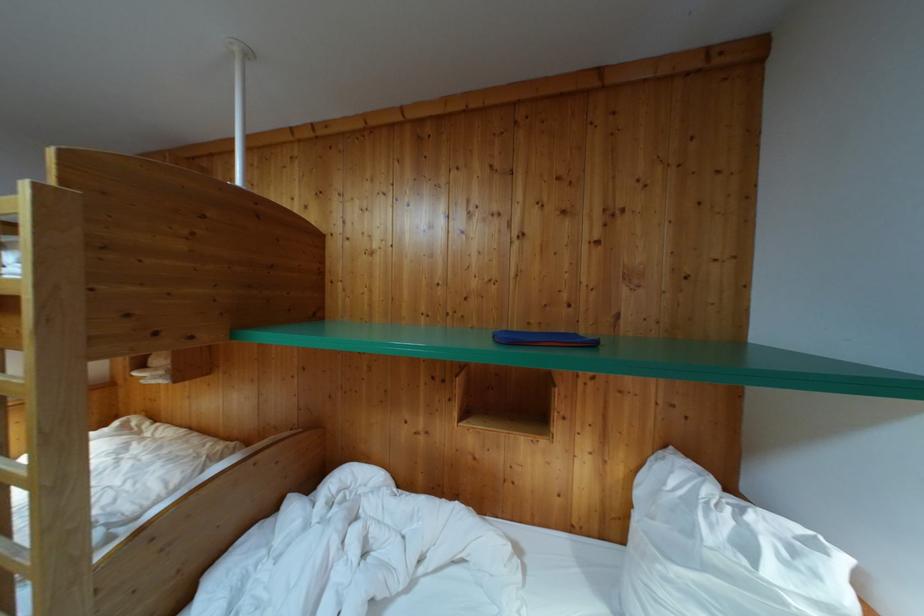
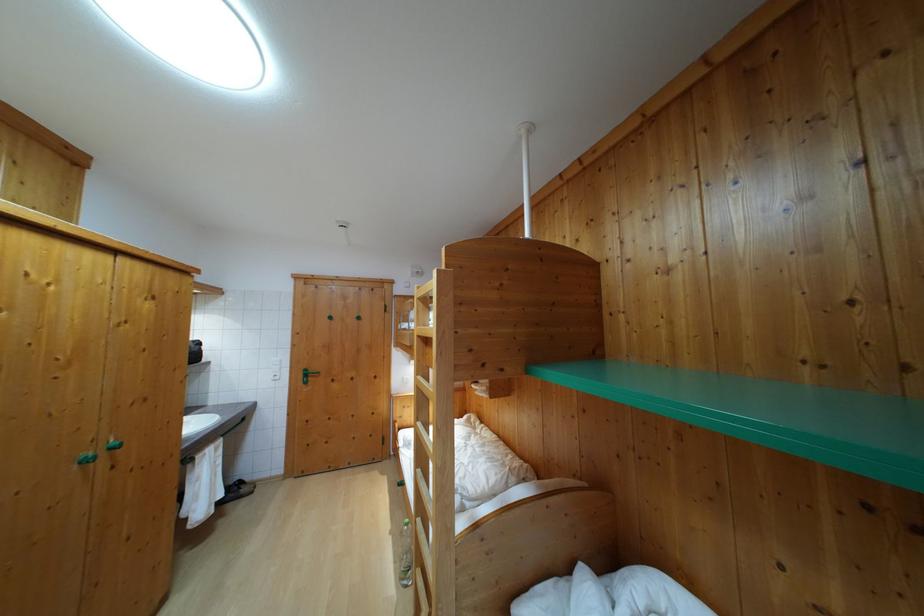
Question: Based on the continuous images, in which direction is the camera rotating? Reply with the corresponding letter.

Choices:
 (A) Left
 (B) Right
 (C) Up
 (D) Down

Answer: (A)